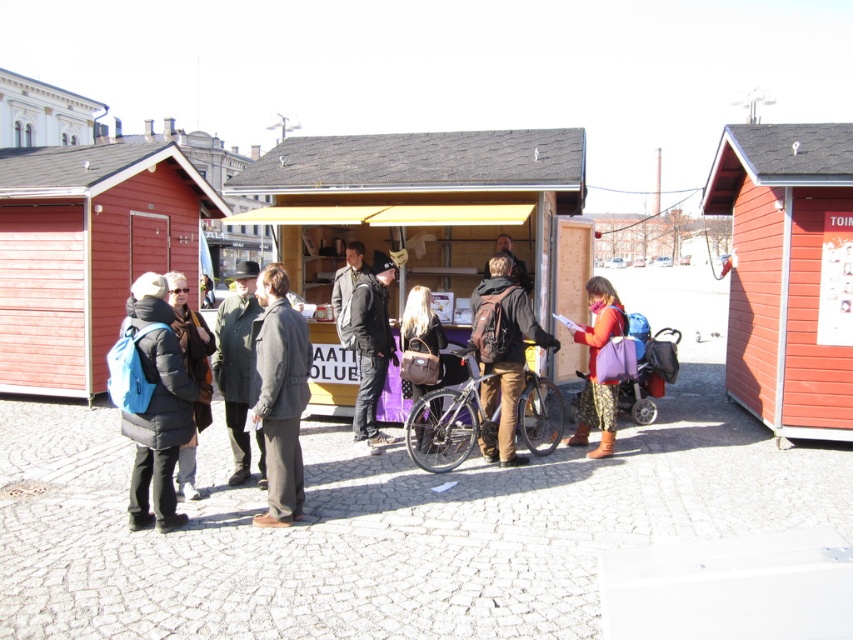
Question: Is gray woolen jacket at center to the left of white stone building at upper left from the viewer's perspective?

Choices:
 (A) yes
 (B) no

Answer: (B)

Question: Can you confirm if wooden hut at left is bigger than dark gray wool coat at center?

Choices:
 (A) yes
 (B) no

Answer: (B)

Question: Is matte black jacket at lower left to the left of matte black backpack at center from the viewer's perspective?

Choices:
 (A) yes
 (B) no

Answer: (A)

Question: Which of the following is the farthest from the observer?

Choices:
 (A) (490, 280)
 (B) (610, 442)
 (C) (74, 100)
 (D) (244, 458)

Answer: (C)

Question: Estimate the real-world distances between objects in this image. Which object is farther from the matte black jacket at left?

Choices:
 (A) dark gray wool coat at center
 (B) dark gray jacket at center
 (C) yellow wood hut at center

Answer: (C)

Question: Which point is farther to the camera?

Choices:
 (A) (410, 168)
 (B) (187, 456)

Answer: (A)